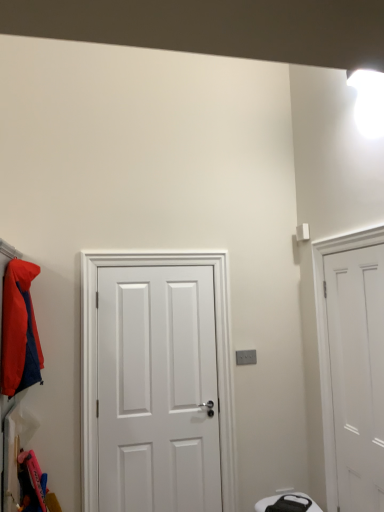
Question: Does white matte door at center, which ranks as the 1th door in left-to-right order, turn towards white matte door at right, marked as the 1th door in a right-to-left arrangement?

Choices:
 (A) yes
 (B) no

Answer: (B)

Question: Is white matte door at center, acting as the 2th door starting from the right, located outside white matte door at right, placed as the 2th door when sorted from left to right?

Choices:
 (A) yes
 (B) no

Answer: (A)

Question: From a real-world perspective, is white matte door at center, acting as the 2th door starting from the right, located beneath white matte door at right, marked as the 1th door in a right-to-left arrangement?

Choices:
 (A) no
 (B) yes

Answer: (B)

Question: Is white matte door at center, which ranks as the 1th door in left-to-right order, to the left of white matte door at right, placed as the 2th door when sorted from left to right, from the viewer's perspective?

Choices:
 (A) yes
 (B) no

Answer: (A)

Question: Is white matte door at center, which ranks as the 1th door in left-to-right order, shorter than white matte door at right, marked as the 1th door in a right-to-left arrangement?

Choices:
 (A) yes
 (B) no

Answer: (B)

Question: Is matte orange jacket at left inside or outside of white matte door at center, acting as the 2th door starting from the right?

Choices:
 (A) outside
 (B) inside

Answer: (A)

Question: Based on their positions, is matte orange jacket at left located to the left or right of white matte door at center, which ranks as the 1th door in left-to-right order?

Choices:
 (A) left
 (B) right

Answer: (A)

Question: Does point (36, 377) appear closer or farther from the camera than point (208, 275)?

Choices:
 (A) farther
 (B) closer

Answer: (B)

Question: Considering the positions of matte orange jacket at left and white matte door at center, which ranks as the 1th door in left-to-right order, in the image, is matte orange jacket at left bigger or smaller than white matte door at center, which ranks as the 1th door in left-to-right order,?

Choices:
 (A) small
 (B) big

Answer: (A)

Question: In the image, is matte orange jacket at left positioned in front of or behind white matte door at right, placed as the 2th door when sorted from left to right?

Choices:
 (A) front
 (B) behind

Answer: (B)

Question: Visually, is matte orange jacket at left positioned to the left or to the right of white matte door at right, marked as the 1th door in a right-to-left arrangement?

Choices:
 (A) left
 (B) right

Answer: (A)

Question: From a real-world perspective, is matte orange jacket at left positioned above or below white matte door at right, placed as the 2th door when sorted from left to right?

Choices:
 (A) above
 (B) below

Answer: (A)

Question: Is matte orange jacket at left inside the boundaries of white matte door at right, placed as the 2th door when sorted from left to right, or outside?

Choices:
 (A) outside
 (B) inside

Answer: (A)

Question: Visually, is white matte door at center, which ranks as the 1th door in left-to-right order, positioned to the left or to the right of white matte door at right, marked as the 1th door in a right-to-left arrangement?

Choices:
 (A) right
 (B) left

Answer: (B)

Question: Considering the positions of white matte door at center, acting as the 2th door starting from the right, and white matte door at right, placed as the 2th door when sorted from left to right, in the image, is white matte door at center, acting as the 2th door starting from the right, bigger or smaller than white matte door at right, placed as the 2th door when sorted from left to right,?

Choices:
 (A) small
 (B) big

Answer: (B)